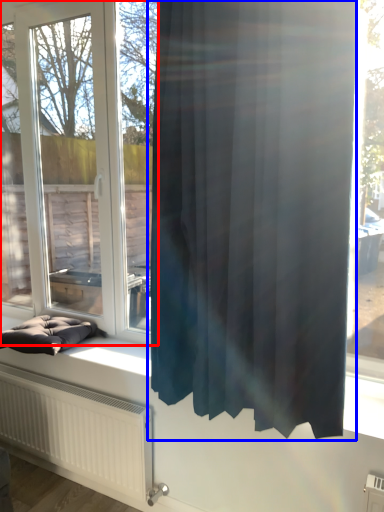
Question: Which point is further to the camera, window (highlighted by a red box) or curtain (highlighted by a blue box)?

Choices:
 (A) window
 (B) curtain

Answer: (A)